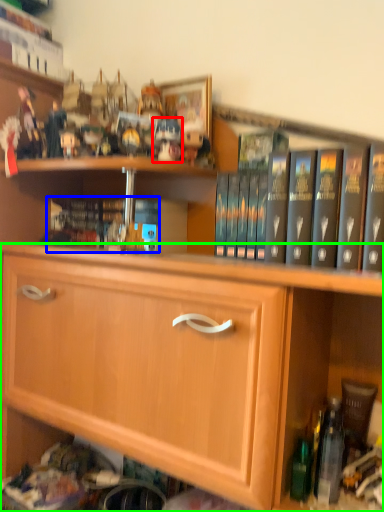
Question: Estimate the real-world distances between objects in this image. Which object is farther from toy (highlighted by a red box), book (highlighted by a blue box) or cabinetry (highlighted by a green box)?

Choices:
 (A) book
 (B) cabinetry

Answer: (B)